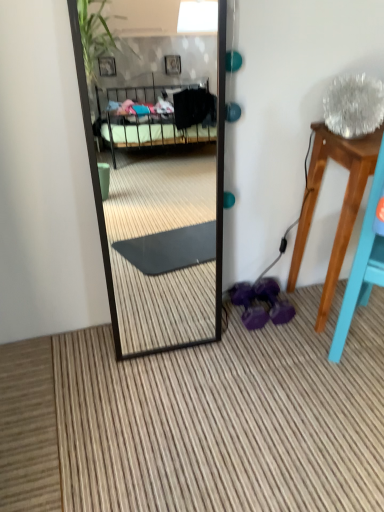
Locate an element on the screen. This screenshot has width=384, height=512. free location in front of purple rubber dumbbells at lower center is located at coordinates (254, 347).